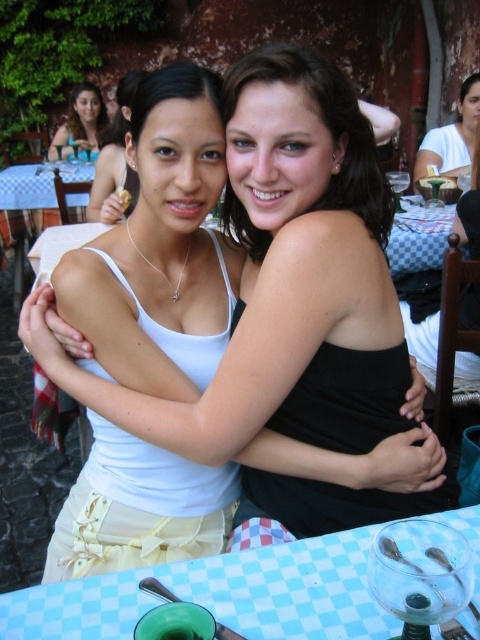
Question: Where is blue checkered tablecloth at lower center located in relation to checkered fabric tablecloth at center in the image?

Choices:
 (A) below
 (B) above

Answer: (A)

Question: Which object is closer to the camera taking this photo?

Choices:
 (A) smooth black hair at center
 (B) black matte dress at center

Answer: (A)

Question: Which object is positioned farthest from the matte black hair at upper left?

Choices:
 (A) smooth black hair at center
 (B) blue checkered tablecloth at lower center

Answer: (B)

Question: Based on their relative distances, which object is nearer to the black matte dress at center?

Choices:
 (A) white matte tank top at center
 (B) matte white tank top at upper center

Answer: (A)

Question: Does smooth black hair at center have a lesser width compared to white matte shirt at upper center?

Choices:
 (A) no
 (B) yes

Answer: (B)

Question: Observing the image, what is the correct spatial positioning of blue checkered tablecloth at lower center in reference to white matte shirt at upper center?

Choices:
 (A) below
 (B) above

Answer: (A)